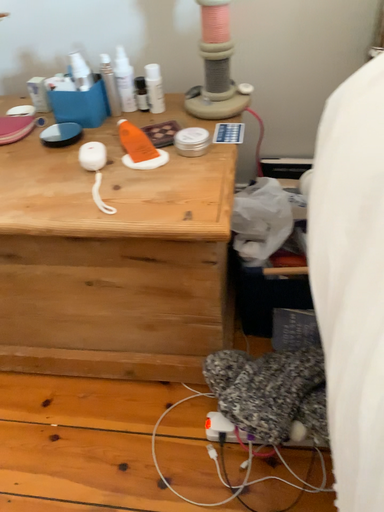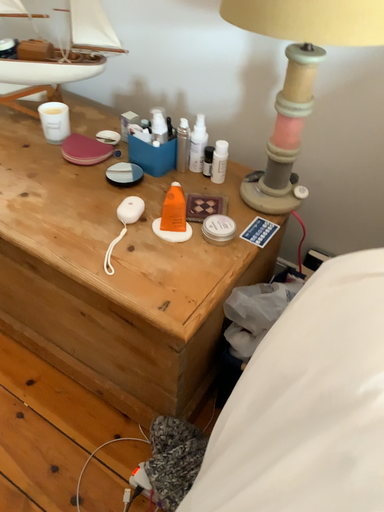
Question: Which way did the camera rotate in the video?

Choices:
 (A) rotated left
 (B) rotated right

Answer: (A)